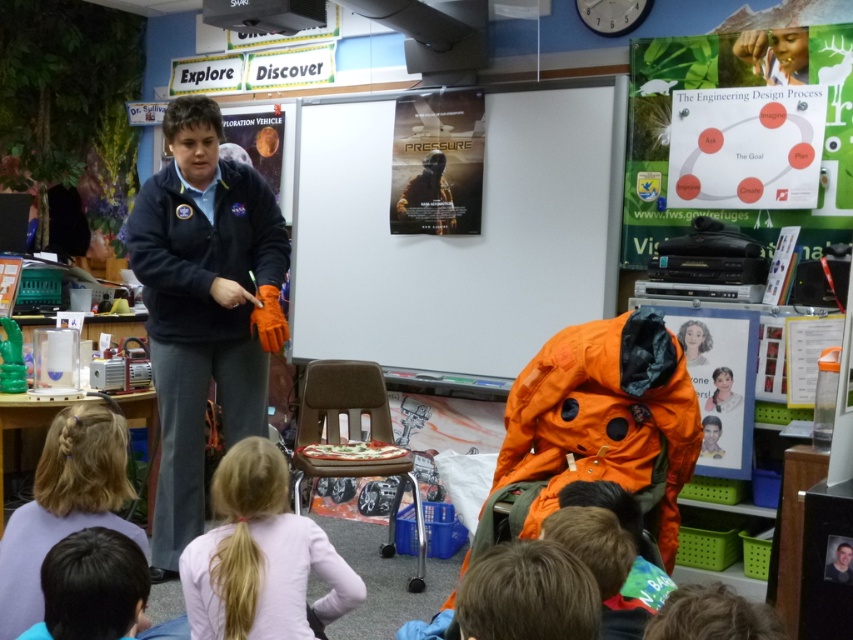
You are standing in the classroom and want to locate the matte orange poster at center. According to the coordinates provided, where should you look?

You should look at point (457, 236) to find the matte orange poster at center.